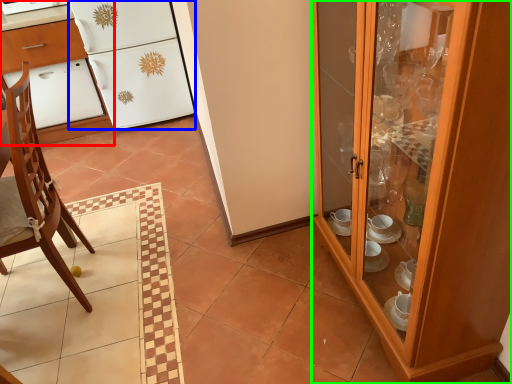
Question: Which object is positioned closest to desk (highlighted by a red box)? Select from refrigerator (highlighted by a blue box) and cabinetry (highlighted by a green box).

Choices:
 (A) refrigerator
 (B) cabinetry

Answer: (A)